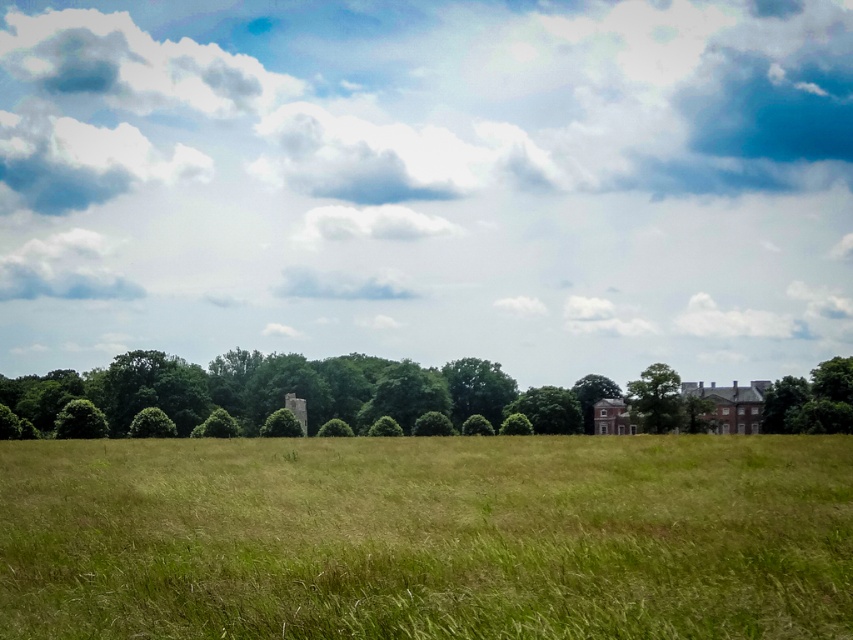
Question: Which point appears farthest from the camera in this image?

Choices:
 (A) (846, 376)
 (B) (827, 538)
 (C) (96, 394)
 (D) (718, 109)

Answer: (D)

Question: Among these objects, which one is farthest from the camera?

Choices:
 (A) green grassy field at center
 (B) green leafy tree at center-right
 (C) green leafy tree at right
 (D) cloudy sky at upper center

Answer: (D)

Question: Can you confirm if cloudy sky at upper center is positioned to the right of green leafy tree at center?

Choices:
 (A) no
 (B) yes

Answer: (B)

Question: Which object appears closest to the camera in this image?

Choices:
 (A) green leafy tree at center
 (B) green grassy field at center
 (C) cloudy sky at upper center

Answer: (B)

Question: In this image, where is green leafy tree at center located relative to green leafy tree at center-right?

Choices:
 (A) right
 (B) left

Answer: (B)

Question: Can you confirm if cloudy sky at upper center is wider than green leafy tree at right?

Choices:
 (A) no
 (B) yes

Answer: (B)